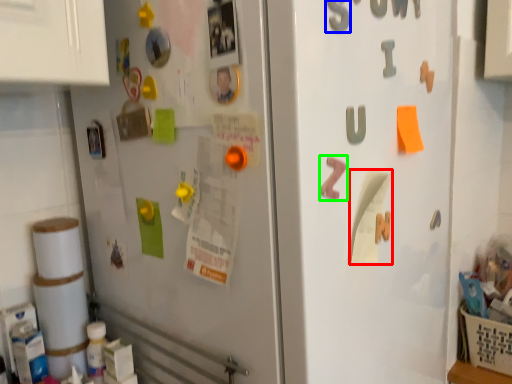
Question: Based on their relative distances, which object is nearer to paper (highlighted by a red box)? Choose from number (highlighted by a blue box) and alphabet (highlighted by a green box).

Choices:
 (A) number
 (B) alphabet

Answer: (B)